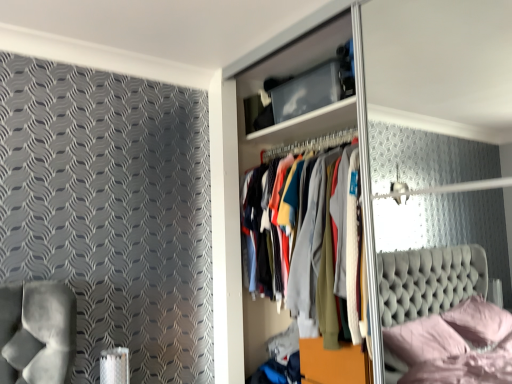
This screenshot has height=384, width=512. What do you see at coordinates (302, 70) in the screenshot? I see `wooden dresser at center` at bounding box center [302, 70].

What is the approximate width of wooden dresser at center?

It is 17.65 inches.

In order to face wooden dresser at center, should I rotate leftwards or rightwards?

Turn right by 6.265 degrees to look at wooden dresser at center.

Locate an element on the screen. The height and width of the screenshot is (384, 512). wooden dresser at center is located at coordinates (302, 70).

In order to face transparent plastic glass door at center, should I rotate leftwards or rightwards?

Turn right by 14.298 degrees to look at transparent plastic glass door at center.

Measure the distance between point (366,41) and camera.

The depth of point (366,41) is 6.69 feet.

Image resolution: width=512 pixels, height=384 pixels. Identify the location of transparent plastic glass door at center. (439, 65).

Describe the element at coordinates (439, 65) in the screenshot. I see `transparent plastic glass door at center` at that location.

I want to click on wooden dresser at center, so click(302, 70).

Which object is positioned more to the left, transparent plastic glass door at center or wooden dresser at center?

Positioned to the left is wooden dresser at center.

Is transparent plastic glass door at center positioned behind wooden dresser at center?

No, transparent plastic glass door at center is closer to the camera.

Which is more distant, (x=409, y=49) or (x=366, y=162)?

Point (x=409, y=49)

From the image's perspective, is transparent plastic glass door at center below wooden dresser at center?

Correct, transparent plastic glass door at center appears lower than wooden dresser at center in the image.

From a real-world perspective, which is physically above, transparent plastic glass door at center or wooden dresser at center?

From a 3D spatial view, wooden dresser at center is above.

In terms of width, does transparent plastic glass door at center look wider or thinner when compared to wooden dresser at center?

In the image, transparent plastic glass door at center appears to be wider than wooden dresser at center.

Between transparent plastic glass door at center and wooden dresser at center, which one has less height?

Standing shorter between the two is wooden dresser at center.

Does transparent plastic glass door at center have a larger size compared to wooden dresser at center?

Yes.

Is transparent plastic glass door at center spatially inside wooden dresser at center, or outside of it?

transparent plastic glass door at center is spatially situated outside wooden dresser at center.

Is transparent plastic glass door at center not close to wooden dresser at center?

transparent plastic glass door at center is actually quite close to wooden dresser at center.

Is transparent plastic glass door at center oriented away from wooden dresser at center?

Absolutely, transparent plastic glass door at center is directed away from wooden dresser at center.

Locate an element on the screen. The height and width of the screenshot is (384, 512). glass door below the wooden dresser at center (from the image's perspective) is located at coordinates (439, 65).

Is wooden dresser at center at the right side of transparent plastic glass door at center?

Incorrect, wooden dresser at center is not on the right side of transparent plastic glass door at center.

Considering the positions of objects wooden dresser at center and transparent plastic glass door at center in the image provided, who is in front, wooden dresser at center or transparent plastic glass door at center?

transparent plastic glass door at center is closer to the camera.

Considering the positions of point (254, 63) and point (423, 118), is point (254, 63) closer or farther from the camera than point (423, 118)?

Clearly, point (254, 63) is closer to the camera than point (423, 118).

From the image's perspective, between wooden dresser at center and transparent plastic glass door at center, who is located below?

From the image's view, transparent plastic glass door at center is below.

From a real-world perspective, which is physically above, wooden dresser at center or transparent plastic glass door at center?

From a 3D spatial view, wooden dresser at center is above.

Which object is thinner, wooden dresser at center or transparent plastic glass door at center?

wooden dresser at center.

Considering the relative sizes of wooden dresser at center and transparent plastic glass door at center in the image provided, is wooden dresser at center shorter than transparent plastic glass door at center?

Yes.

From the picture: In terms of size, does wooden dresser at center appear bigger or smaller than transparent plastic glass door at center?

wooden dresser at center is smaller than transparent plastic glass door at center.

Is wooden dresser at center situated inside transparent plastic glass door at center or outside?

wooden dresser at center is contained in transparent plastic glass door at center.

Is wooden dresser at center positioned far away from transparent plastic glass door at center?

Actually, wooden dresser at center and transparent plastic glass door at center are a little close together.

Is wooden dresser at center facing towards transparent plastic glass door at center?

Yes.

What's the angular difference between wooden dresser at center and transparent plastic glass door at center's facing directions?

The facing directions of wooden dresser at center and transparent plastic glass door at center are 0.711 degrees apart.

How much distance is there between wooden dresser at center and transparent plastic glass door at center?

They are 27.49 inches apart.

This screenshot has width=512, height=384. I want to click on glass door in front of the wooden dresser at center, so click(439, 65).

The height and width of the screenshot is (384, 512). Find the location of `dresser to the left of transparent plastic glass door at center`. dresser to the left of transparent plastic glass door at center is located at coordinates (302, 70).

Where is `glass door below the wooden dresser at center (from the image's perspective)`? glass door below the wooden dresser at center (from the image's perspective) is located at coordinates pyautogui.click(x=439, y=65).